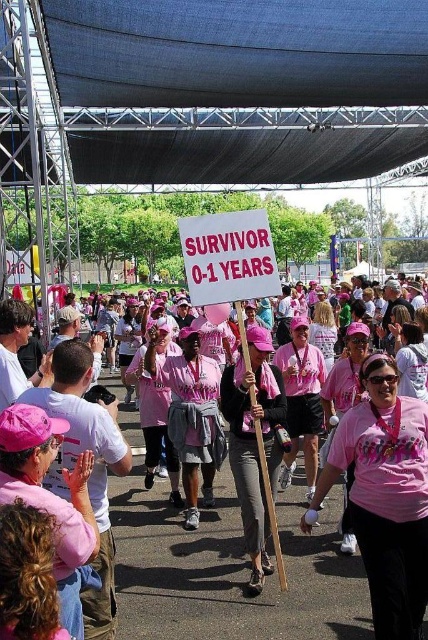
Question: Which point is closer to the camera?

Choices:
 (A) pink matte shirt at center
 (B) pink fabric sign at center

Answer: (A)

Question: Among these objects, which one is nearest to the camera?

Choices:
 (A) pink matte shirt at center
 (B) pink fabric sign at center

Answer: (A)

Question: Does pink fabric sign at center have a smaller size compared to pink fabric shirt at center?

Choices:
 (A) no
 (B) yes

Answer: (A)

Question: Does pink matte shirt at center have a larger size compared to pink fabric shirt at center?

Choices:
 (A) yes
 (B) no

Answer: (B)

Question: Does pink matte shirt at center have a larger size compared to pink fabric shirt at center?

Choices:
 (A) yes
 (B) no

Answer: (B)

Question: Which point is closer to the camera taking this photo?

Choices:
 (A) (326, 365)
 (B) (392, 573)

Answer: (B)